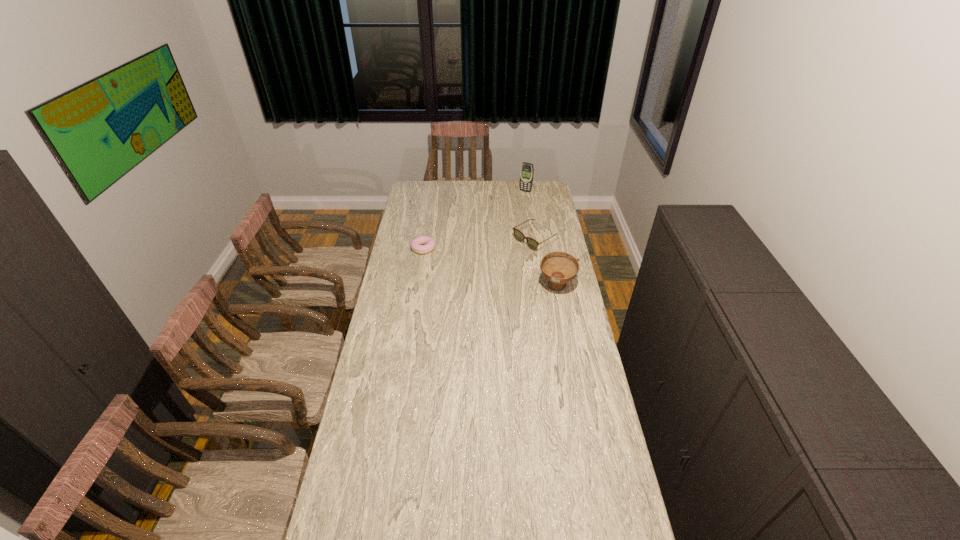
Locate an element on the screen. Image resolution: width=960 pixels, height=540 pixels. the shortest object is located at coordinates (423, 244).

Image resolution: width=960 pixels, height=540 pixels. I want to click on doughnut, so click(423, 244).

Find the location of a particular element. The image size is (960, 540). the nearest object is located at coordinates (559, 268).

The width and height of the screenshot is (960, 540). I want to click on the second tallest object, so click(x=559, y=268).

Where is `the second shortest object`? The image size is (960, 540). the second shortest object is located at coordinates (519, 236).

Identify the location of cellular telephone. (527, 170).

I want to click on the farthest object, so click(527, 170).

Locate an element on the screen. free space located on the back of the leftmost object is located at coordinates (427, 226).

The width and height of the screenshot is (960, 540). Identify the location of vacant space situated on the left of the nearest object. (507, 287).

Locate an element on the screen. free spot located 0.360m at the front view of the third tallest object is located at coordinates (467, 278).